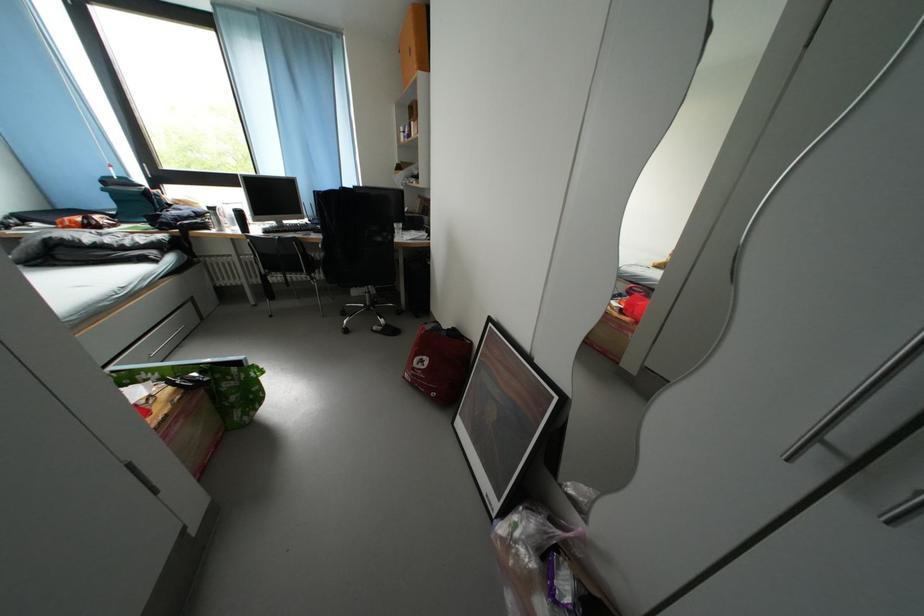
Describe the element at coordinates (358, 248) in the screenshot. I see `the chair armrest` at that location.